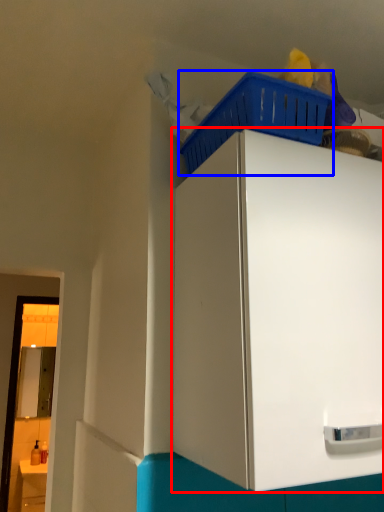
Question: Which of the following is the farthest to the observer, cabinetry (highlighted by a red box) or basket (highlighted by a blue box)?

Choices:
 (A) cabinetry
 (B) basket

Answer: (B)